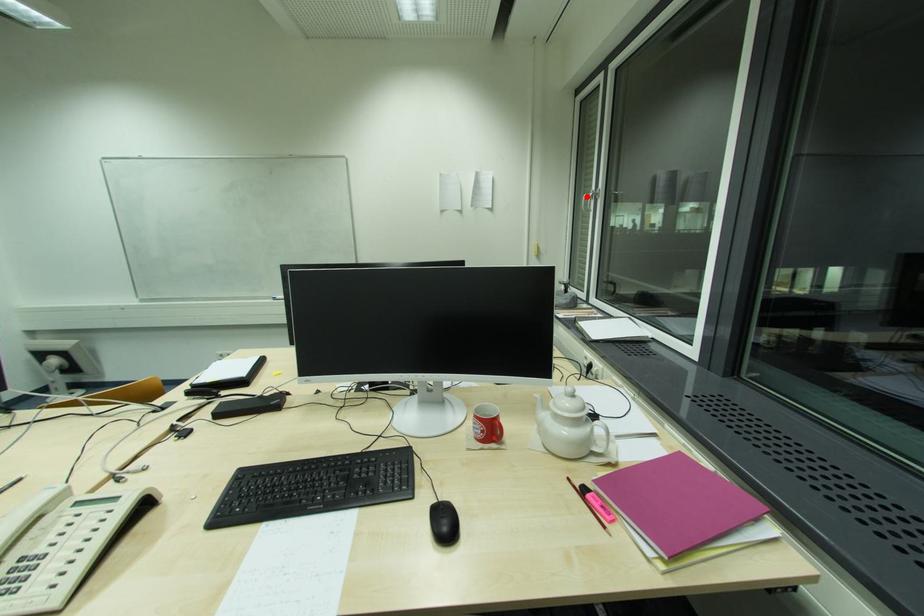
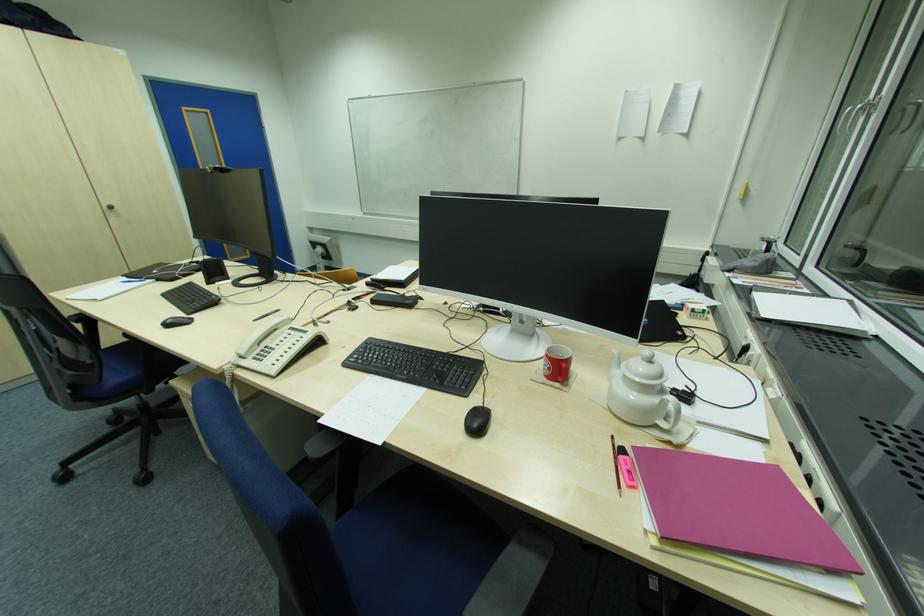
Question: I am providing you with two images of the same scene from different viewpoints. In image1, a red point is highlighted. Considering the same 3D point in image2, which of the following is correct?

Choices:
 (A) It is closer
 (B) It is farther

Answer: (B)